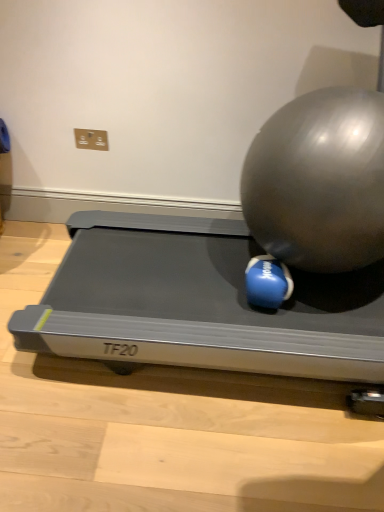
Question: In the image, is shiny metallic ball at center right, which is counted as the 1th ball, starting from the right, positioned in front of or behind blue rubber ball at center, positioned as the second ball in right-to-left order?

Choices:
 (A) front
 (B) behind

Answer: (A)

Question: From the image's perspective, is shiny metallic ball at center right, arranged as the second ball when viewed from the left, located above or below blue rubber ball at center, marked as the 1th ball in a left-to-right arrangement?

Choices:
 (A) above
 (B) below

Answer: (A)

Question: Estimate the real-world distances between objects in this image. Which object is closer to the shiny metallic ball at center right, arranged as the second ball when viewed from the left?

Choices:
 (A) silver metallic treadmill at center
 (B) blue rubber ball at center, positioned as the second ball in right-to-left order

Answer: (B)

Question: Which of these objects is positioned farthest from the shiny metallic ball at center right, which is counted as the 1th ball, starting from the right?

Choices:
 (A) blue rubber ball at center, positioned as the second ball in right-to-left order
 (B) silver metallic treadmill at center

Answer: (B)